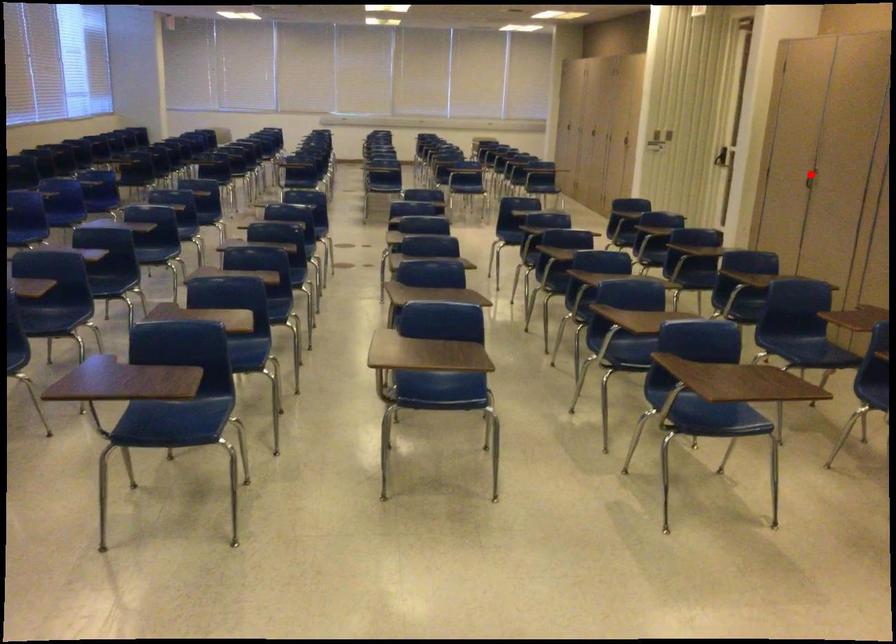
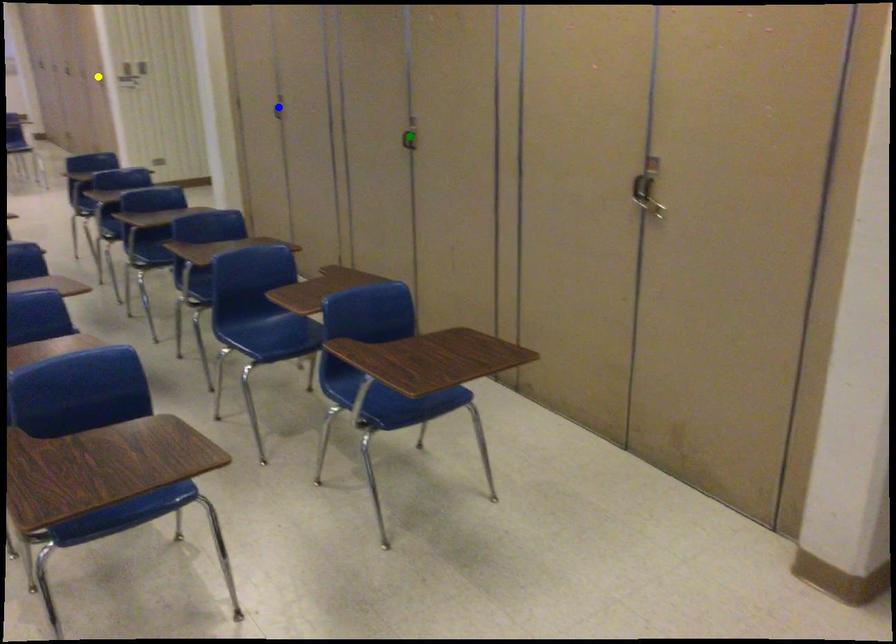
Question: I am providing you with two images of the same scene from different viewpoints. A red point is marked on the first image. You are given multiple points on the second image. Which point in image 2 represents the same 3d spot as the red point in image 1?

Choices:
 (A) yellow point
 (B) green point
 (C) blue point

Answer: (C)